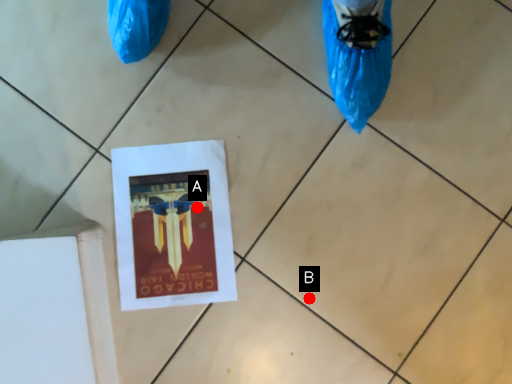
Question: Two points are circled on the image, labeled by A and B beside each circle. Which point is farther to the camera?

Choices:
 (A) A is further
 (B) B is further

Answer: (A)